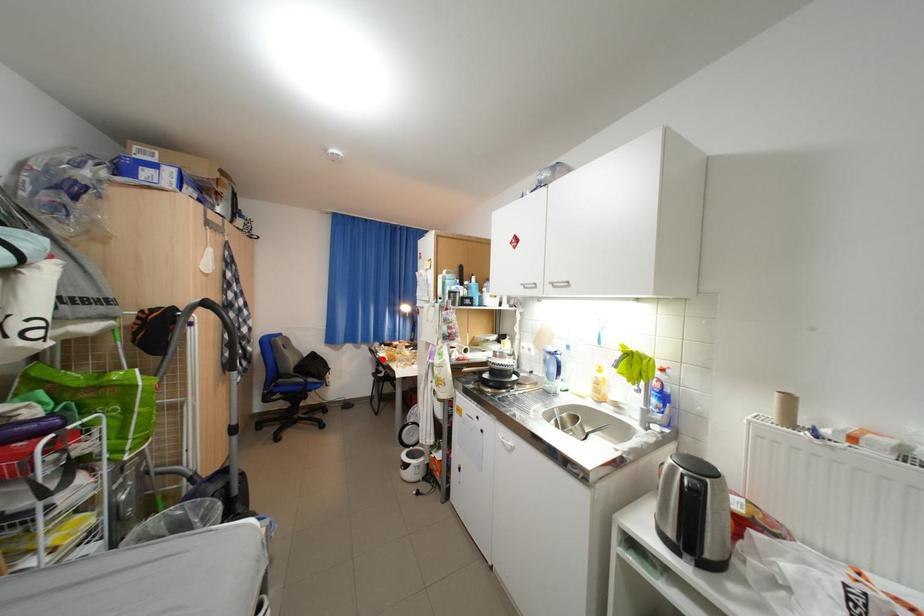
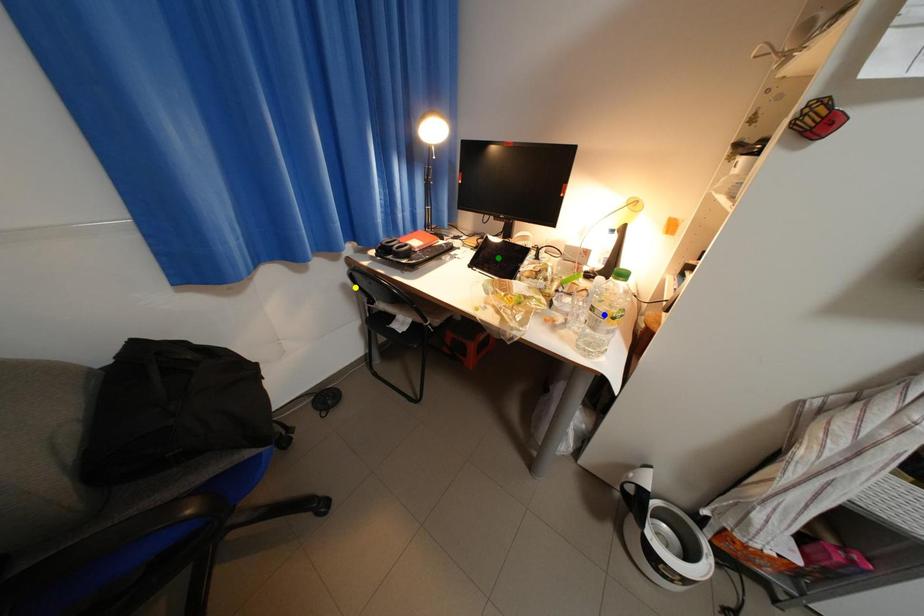
Question: I am providing you with two images of the same scene from different viewpoints. A red point is marked on the first image. You are given multiple points on the second image. In image 2, which mark is for the same physical point as the one in image 1?

Choices:
 (A) green point
 (B) yellow point
 (C) blue point

Answer: (B)